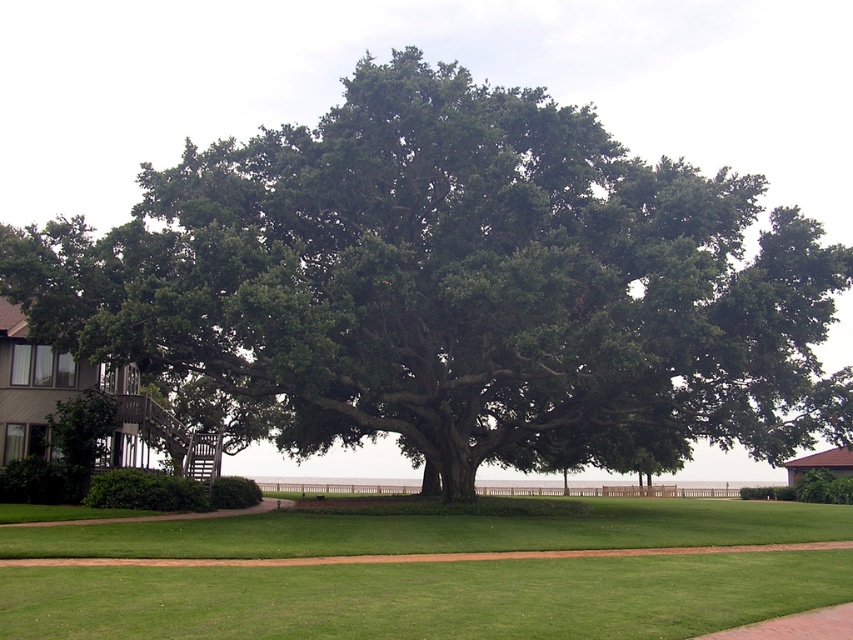
You are a gardener planning to place a new bench in the garden. You want the bench to be placed where there is more space between the green leafy tree at center and the green smooth grass at center. Which area should you choose?

The green leafy tree at center is wider than the green smooth grass at center, so placing the bench near the tree would provide more space between them.

You are standing on the green smooth grass at center and want to walk to the edge of the green leafy tree at center. Which direction should you walk to avoid stepping on the tree?

The green leafy tree at center is positioned over green smooth grass at center, so you should walk away from the tree to avoid stepping on it.